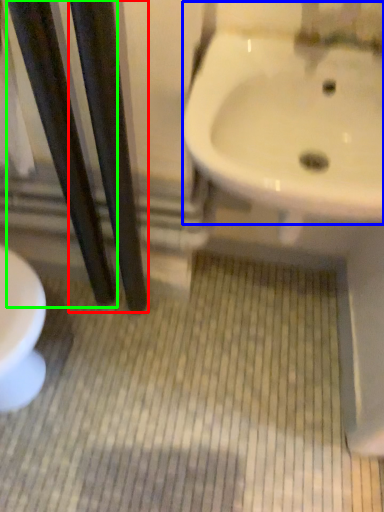
Question: Which is farther away from pole (highlighted by a red box)? sink (highlighted by a blue box) or pole (highlighted by a green box)?

Choices:
 (A) sink
 (B) pole

Answer: (A)